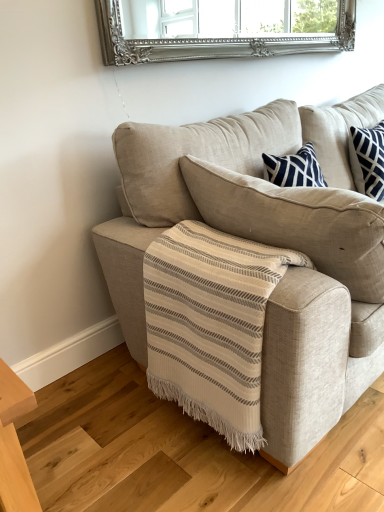
This screenshot has height=512, width=384. What are the coordinates of `vacant space situated above wooden floor at lower left (from a real-world perspective)` in the screenshot? It's located at (187, 443).